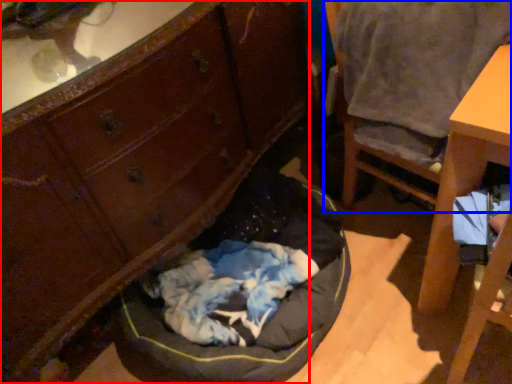
Question: Among these objects, which one is farthest to the camera, cabinetry (highlighted by a red box) or chair (highlighted by a blue box)?

Choices:
 (A) cabinetry
 (B) chair

Answer: (B)